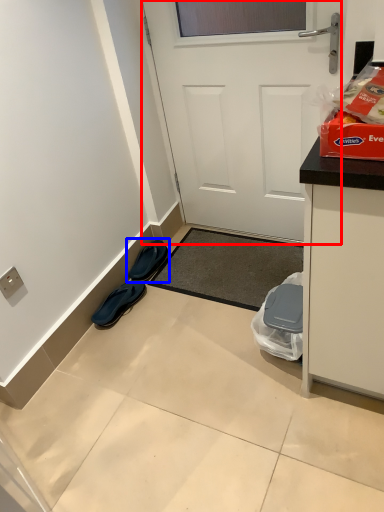
Question: Which object appears farthest to the camera in this image, door (highlighted by a red box) or footwear (highlighted by a blue box)?

Choices:
 (A) door
 (B) footwear

Answer: (B)